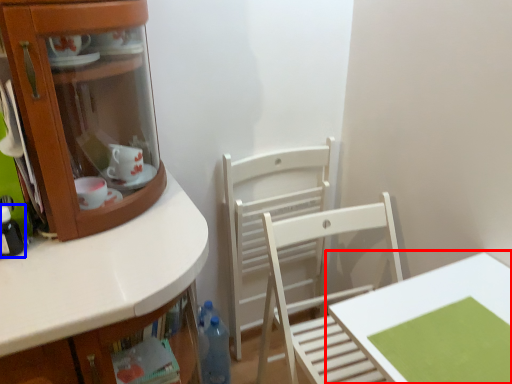
Question: Which point is further to the camera, table (highlighted by a red box) or bottle (highlighted by a blue box)?

Choices:
 (A) table
 (B) bottle

Answer: (B)